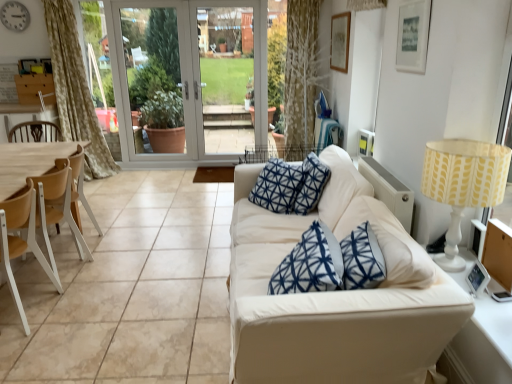
Question: Is silver metallic clock at upper left facing towards light brown wood armchair at left?

Choices:
 (A) yes
 (B) no

Answer: (B)

Question: Considering the relative sizes of silver metallic clock at upper left and light brown wood armchair at left in the image provided, is silver metallic clock at upper left bigger than light brown wood armchair at left?

Choices:
 (A) no
 (B) yes

Answer: (A)

Question: Can you confirm if silver metallic clock at upper left is positioned to the right of light brown wood armchair at left?

Choices:
 (A) no
 (B) yes

Answer: (A)

Question: Is silver metallic clock at upper left surrounding light brown wood armchair at left?

Choices:
 (A) no
 (B) yes

Answer: (A)

Question: Are silver metallic clock at upper left and light brown wood armchair at left beside each other?

Choices:
 (A) yes
 (B) no

Answer: (B)

Question: Looking at the image, does yellow fabric lampshade at right seem bigger or smaller compared to white glass screen door at center, positioned as the first screen door in left-to-right order?

Choices:
 (A) small
 (B) big

Answer: (A)

Question: From the image's perspective, is yellow fabric lampshade at right positioned above or below white glass screen door at center, the 2th screen door when ordered from right to left?

Choices:
 (A) above
 (B) below

Answer: (B)

Question: Would you say yellow fabric lampshade at right is to the left or to the right of white glass screen door at center, positioned as the first screen door in left-to-right order, in the picture?

Choices:
 (A) left
 (B) right

Answer: (B)

Question: Is yellow fabric lampshade at right taller or shorter than white glass screen door at center, the 2th screen door when ordered from right to left?

Choices:
 (A) tall
 (B) short

Answer: (B)

Question: Considering the positions of white glass screen door at center, the 2th screen door when ordered from right to left, and silver metallic clock at upper left in the image, is white glass screen door at center, the 2th screen door when ordered from right to left, bigger or smaller than silver metallic clock at upper left?

Choices:
 (A) small
 (B) big

Answer: (B)

Question: Relative to silver metallic clock at upper left, is white glass screen door at center, positioned as the first screen door in left-to-right order, in front or behind?

Choices:
 (A) behind
 (B) front

Answer: (A)

Question: Is white glass screen door at center, positioned as the first screen door in left-to-right order, wider or thinner than silver metallic clock at upper left?

Choices:
 (A) wide
 (B) thin

Answer: (A)

Question: From the image's perspective, is white glass screen door at center, the 2th screen door when ordered from right to left, positioned above or below silver metallic clock at upper left?

Choices:
 (A) below
 (B) above

Answer: (A)

Question: From a real-world perspective, is matte white picture frame at upper right positioned above or below yellow fabric lampshade at right?

Choices:
 (A) above
 (B) below

Answer: (A)

Question: From the image's perspective, is matte white picture frame at upper right above or below yellow fabric lampshade at right?

Choices:
 (A) below
 (B) above

Answer: (B)